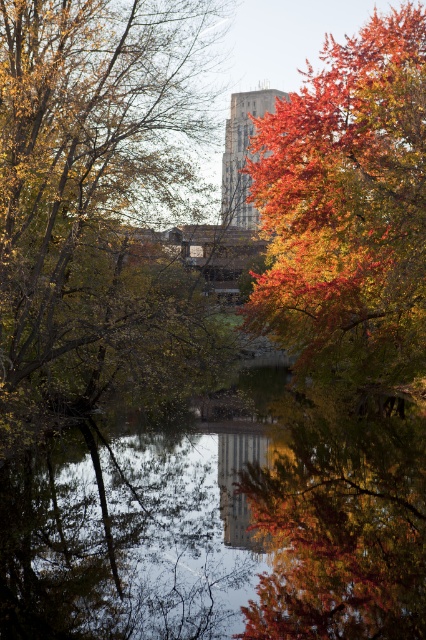
You are standing in the autumn scene and want to take a photo. You notice two points marked in the image. Which point is closer to your camera lens? Please choose between point (x=333, y=241) and point (x=230, y=184).

Point (x=333, y=241) is closer to the camera lens than point (x=230, y=184).

You are standing in the autumnal scene and want to walk from your current position to a point closer to the tree with red and orange leaves. Which of the two points, point (94, 280) or point (247, 141), should you head towards?

You should head towards point (94, 280) because it is in front of point (247, 141), meaning it is closer to your current position and thus nearer to the tree with red and orange leaves.